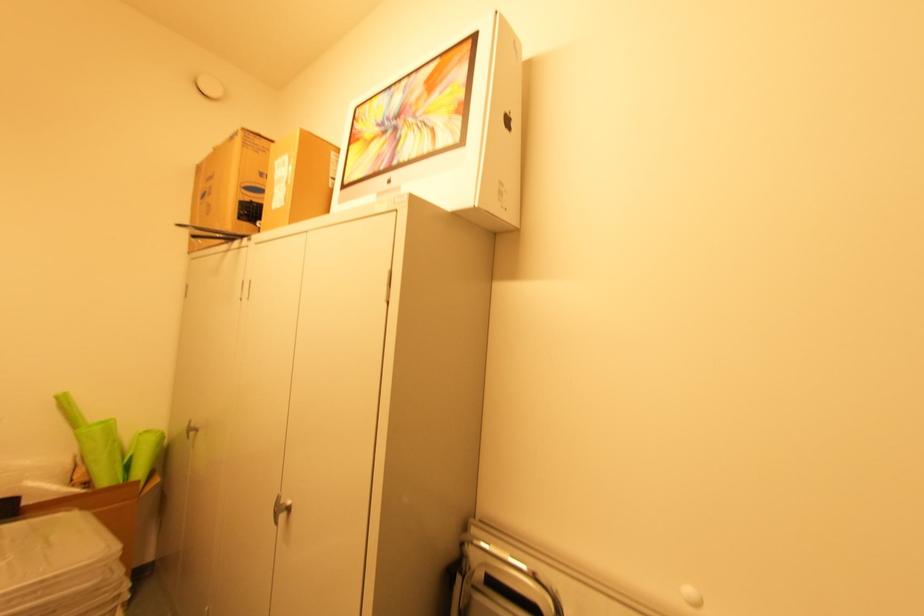
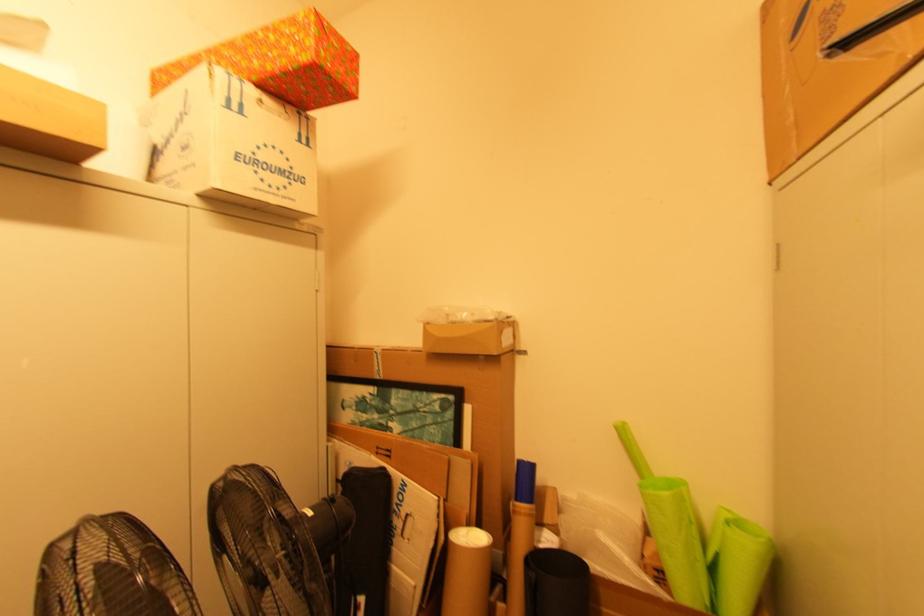
Where in the second image is the point corresponding to pixel 89 479 from the first image?

(659, 565)